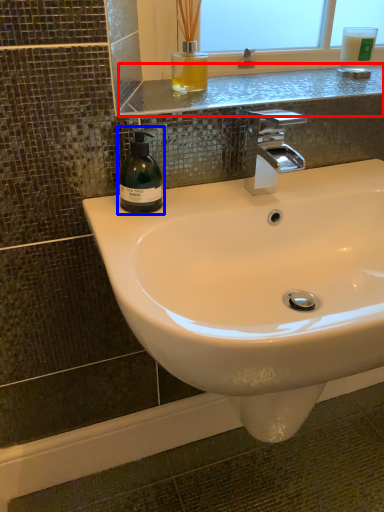
Question: Which object appears farthest to the camera in this image, window sill (highlighted by a red box) or soap dispenser (highlighted by a blue box)?

Choices:
 (A) window sill
 (B) soap dispenser

Answer: (A)